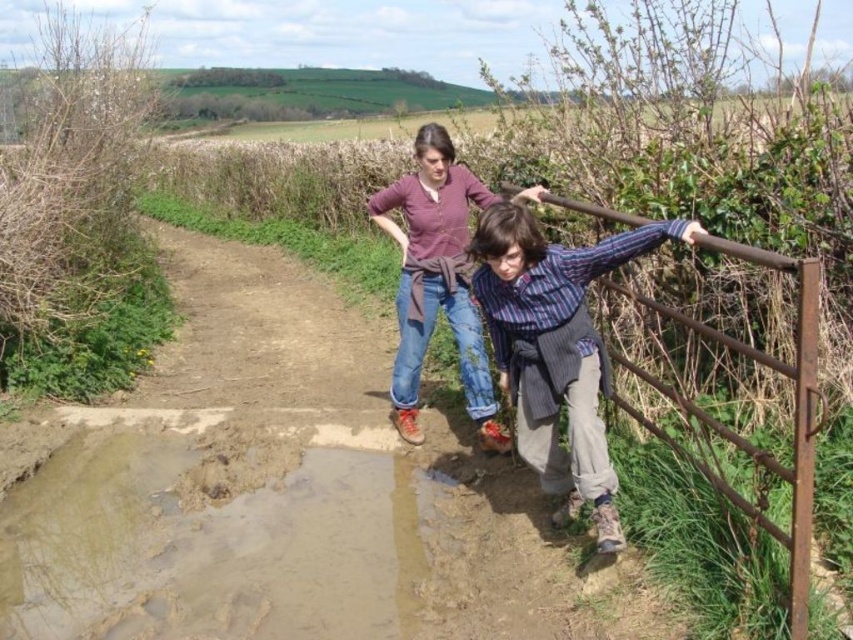
Is the position of muddy wet puddle at lower left more distant than that of striped cotton shirt at right?

Yes, it is.

Who is positioned more to the left, muddy wet puddle at lower left or striped cotton shirt at right?

muddy wet puddle at lower left is more to the left.

Who is more forward, (148, 628) or (602, 385)?

Point (148, 628) is in front.

Where is `muddy wet puddle at lower left`? muddy wet puddle at lower left is located at coordinates (218, 544).

Where is `muddy wet puddle at lower left`? The image size is (853, 640). muddy wet puddle at lower left is located at coordinates (218, 544).

Is muddy wet puddle at lower left taller than matte purple shirt at center?

No.

Is point (54, 550) positioned behind point (407, 440)?

No, (54, 550) is closer to viewer.

At what (x,y) coordinates should I click in order to perform the action: click on muddy wet puddle at lower left. Please return your answer as a coordinate pair (x, y). Looking at the image, I should click on (218, 544).

Is striped cotton shirt at right smaller than rusty metal gate at right?

Indeed, striped cotton shirt at right has a smaller size compared to rusty metal gate at right.

Who is positioned more to the left, striped cotton shirt at right or rusty metal gate at right?

striped cotton shirt at right is more to the left.

Is point (535, 442) behind point (790, 566)?

Yes, point (535, 442) is farther from viewer.

Locate an element on the screen. The height and width of the screenshot is (640, 853). striped cotton shirt at right is located at coordinates (555, 348).